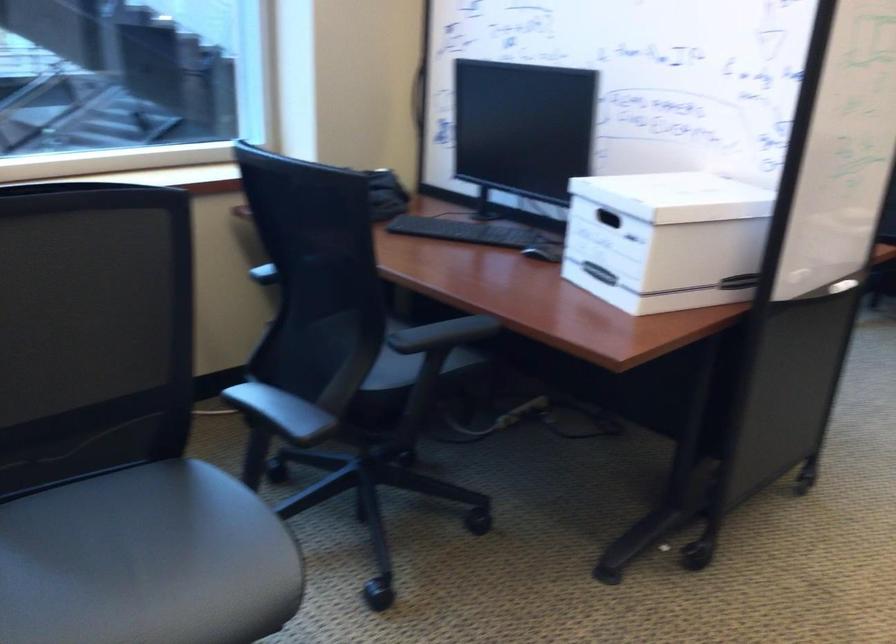
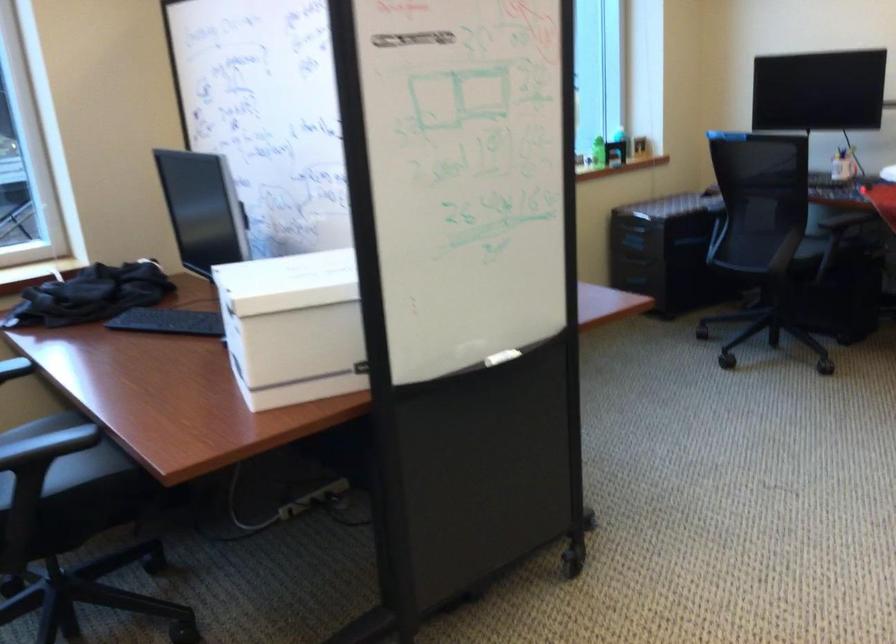
In the second image, find the point that corresponds to point (419, 357) in the first image.

(65, 464)